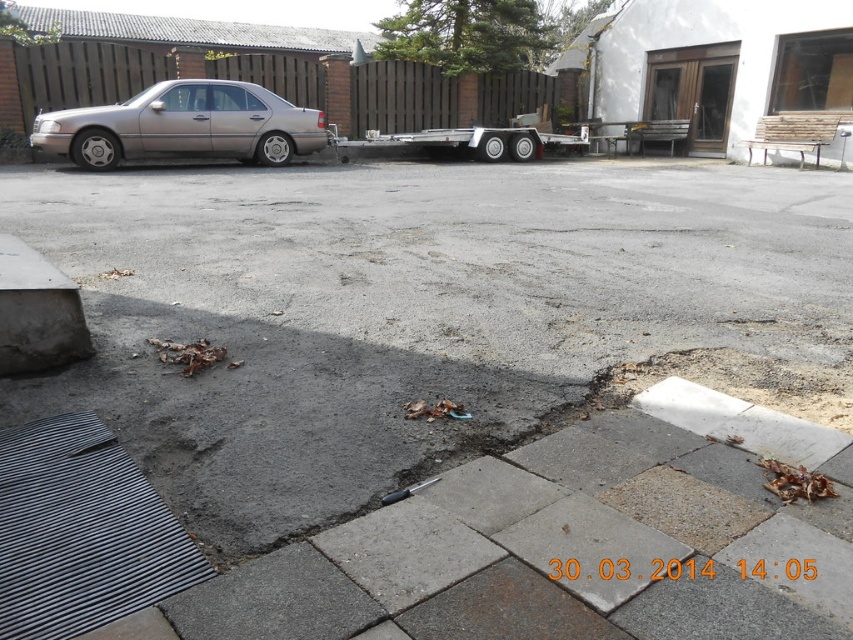
Question: Can you confirm if metallic gold car at left is wider than silver metallic trailer truck at center?

Choices:
 (A) yes
 (B) no

Answer: (B)

Question: Which point is closer to the camera?

Choices:
 (A) silver metallic trailer truck at center
 (B) metallic gold car at left

Answer: (B)

Question: Among these points, which one is nearest to the camera?

Choices:
 (A) (245, 148)
 (B) (581, 134)

Answer: (A)

Question: Is metallic gold car at left above silver metallic trailer truck at center?

Choices:
 (A) no
 (B) yes

Answer: (A)

Question: Which point is closer to the camera?

Choices:
 (A) (378, 141)
 (B) (305, 145)

Answer: (B)

Question: Is metallic gold car at left wider than silver metallic trailer truck at center?

Choices:
 (A) no
 (B) yes

Answer: (A)